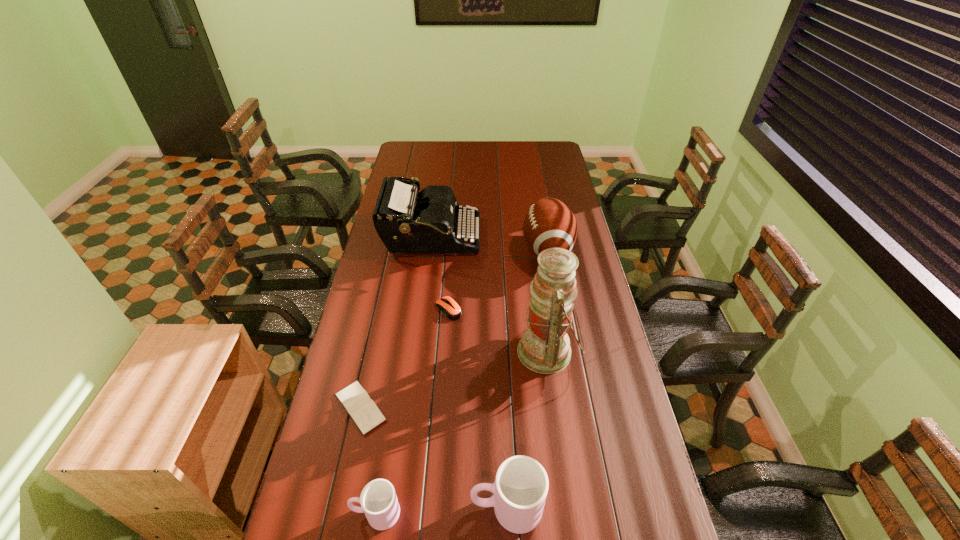
Identify the location of the third shortest object. The image size is (960, 540). (378, 500).

Locate an element on the screen. The height and width of the screenshot is (540, 960). the left cup is located at coordinates (378, 500).

At what (x,y) coordinates should I click in order to perform the action: click on the taller cup. Please return your answer as a coordinate pair (x, y). Looking at the image, I should click on (520, 489).

This screenshot has height=540, width=960. In order to click on the fourth tallest object in this screenshot , I will do `click(520, 489)`.

Find the location of a particular element. The width and height of the screenshot is (960, 540). football is located at coordinates (549, 223).

I want to click on the second shortest object, so click(x=452, y=310).

Locate an element on the screen. The height and width of the screenshot is (540, 960). the fifth nearest object is located at coordinates (452, 310).

Image resolution: width=960 pixels, height=540 pixels. I want to click on oil lamp, so click(x=544, y=347).

Where is `typewriter`? This screenshot has height=540, width=960. typewriter is located at coordinates (406, 224).

The image size is (960, 540). In order to click on diary in this screenshot , I will do `click(356, 401)`.